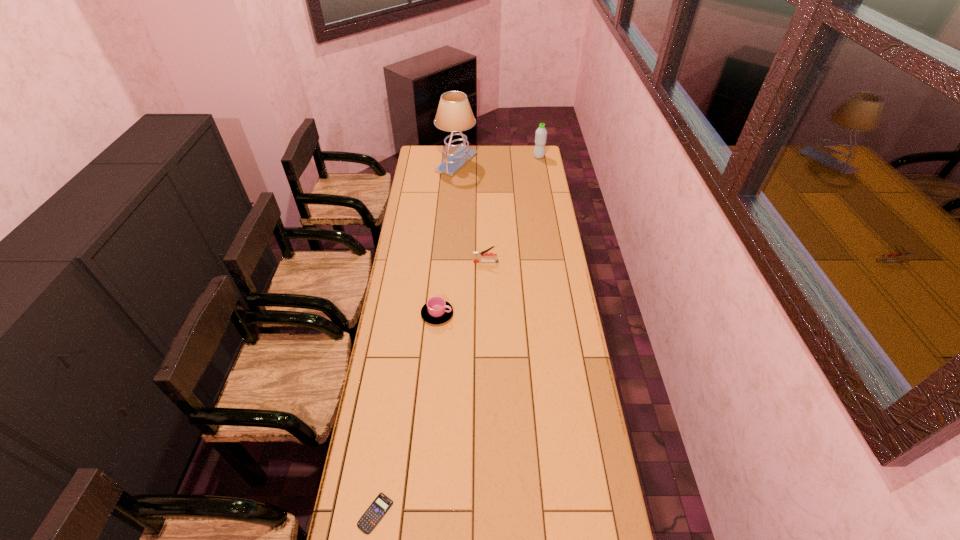
Where is `calculator located at the left edge`? The width and height of the screenshot is (960, 540). calculator located at the left edge is located at coordinates (372, 516).

At what (x,y) coordinates should I click in order to perform the action: click on object located in the right edge section of the desktop. Please return your answer as a coordinate pair (x, y). The width and height of the screenshot is (960, 540). Looking at the image, I should click on (541, 133).

Where is `object present at the far left corner`? object present at the far left corner is located at coordinates (454, 114).

This screenshot has width=960, height=540. What are the coordinates of `object that is positioned at the far right corner` in the screenshot? It's located at (541, 133).

Find the location of a particular element. vacant space at the far edge of the desktop is located at coordinates (492, 163).

In the image, there is a desktop. Identify the location of blank space at the left edge. (359, 482).

Identify the location of free region at the right edge of the desktop. (541, 229).

Where is `free space between the shortest object and the third shortest object`? free space between the shortest object and the third shortest object is located at coordinates (431, 387).

The image size is (960, 540). In order to click on vacant area between the water bottle and the fourth farthest object in this screenshot , I will do `click(488, 235)`.

I want to click on vacant area that lies between the second nearest object and the water bottle, so click(x=488, y=235).